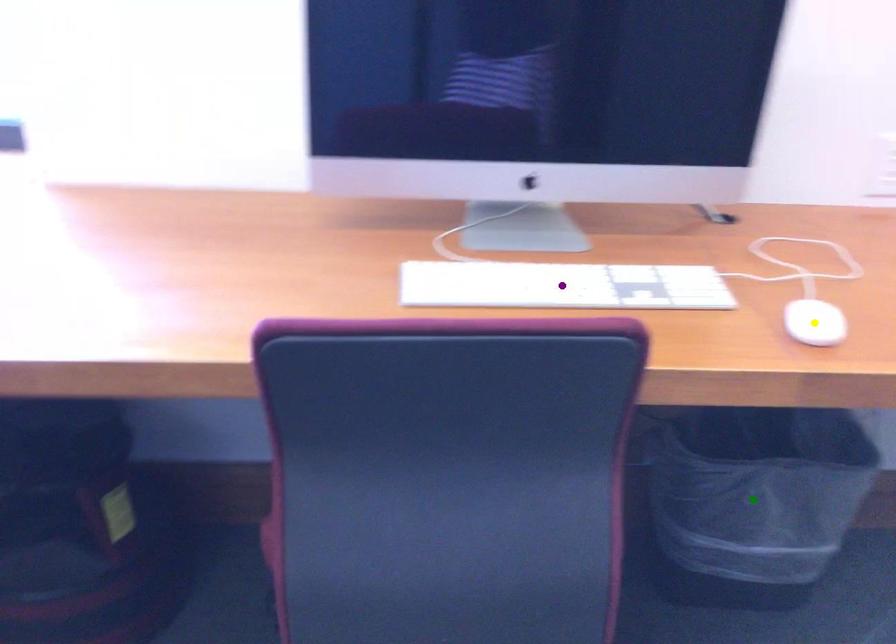
Order these from nearest to farthest:
purple point, green point, yellow point

1. yellow point
2. purple point
3. green point